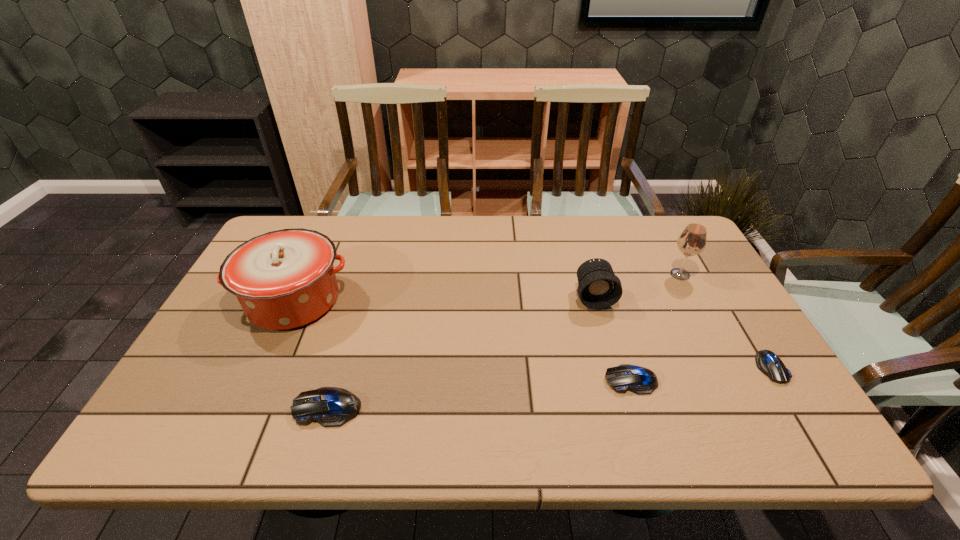
What are the coordinates of `free space for an extra mouse_(computer_equipment) to achieve even spacing` in the screenshot? It's located at (483, 394).